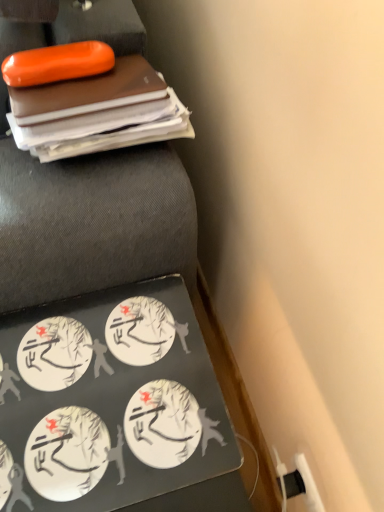
This screenshot has height=512, width=384. I want to click on vacant space situated above white matte stickers at bottom left (from a real-world perspective), so pyautogui.click(x=86, y=402).